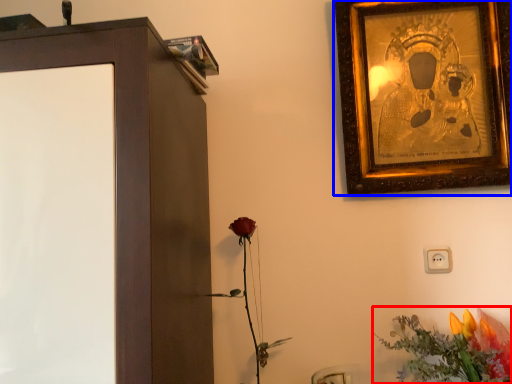
Question: Which of the following is the closest to the observer, flower (highlighted by a red box) or picture frame (highlighted by a blue box)?

Choices:
 (A) flower
 (B) picture frame

Answer: (A)